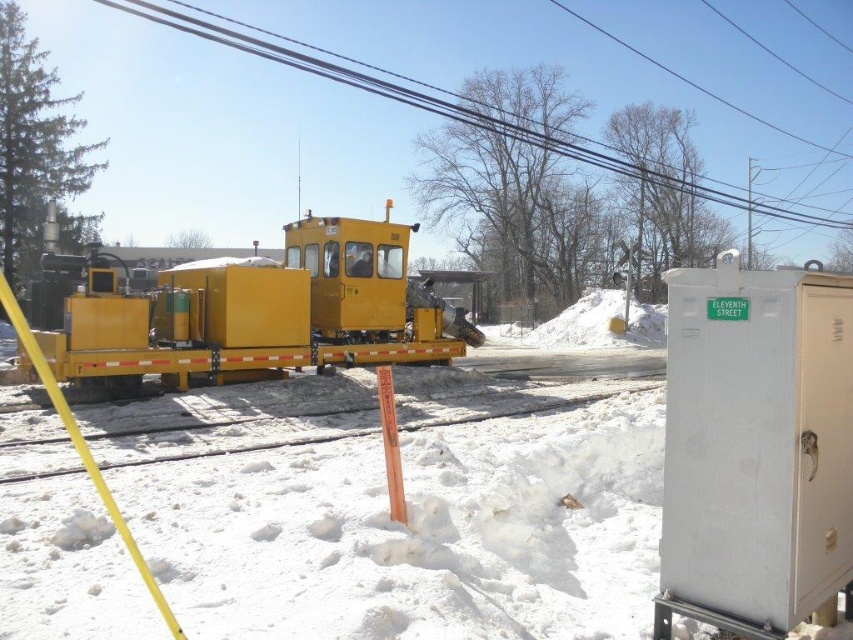
Does white metallic cabinet at right have a greater height compared to yellow matte train at center?

In fact, white metallic cabinet at right may be shorter than yellow matte train at center.

Is point (833, 608) closer to viewer compared to point (335, 346)?

Yes, point (833, 608) is in front of point (335, 346).

Find the location of a particular element. This screenshot has height=640, width=853. white metallic cabinet at right is located at coordinates (756, 449).

Which is more to the right, white metallic cabinet at right or smooth yellow cable at upper center?

white metallic cabinet at right

Between white metallic cabinet at right and smooth yellow cable at upper center, which one is positioned higher?

smooth yellow cable at upper center is above.

Does point (724, 308) come farther from viewer compared to point (172, 17)?

No, (724, 308) is in front of (172, 17).

Find the location of a particular element. white metallic cabinet at right is located at coordinates (756, 449).

Is yellow matte train at center positioned behind smooth yellow cable at upper center?

No, it is in front of smooth yellow cable at upper center.

What do you see at coordinates (248, 310) in the screenshot? I see `yellow matte train at center` at bounding box center [248, 310].

You are a GUI agent. You are given a task and a screenshot of the screen. Output one action in this format:
    pyautogui.click(x=<x>, y=<y>)
    Task: Click on the yellow matte train at center
    The height and width of the screenshot is (640, 853).
    Given the screenshot: What is the action you would take?
    pyautogui.click(x=248, y=310)